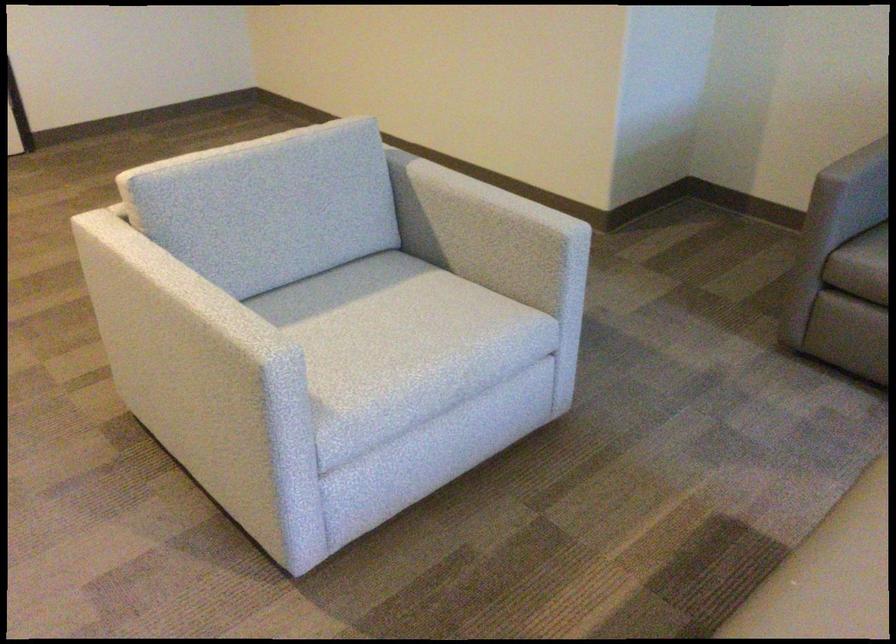
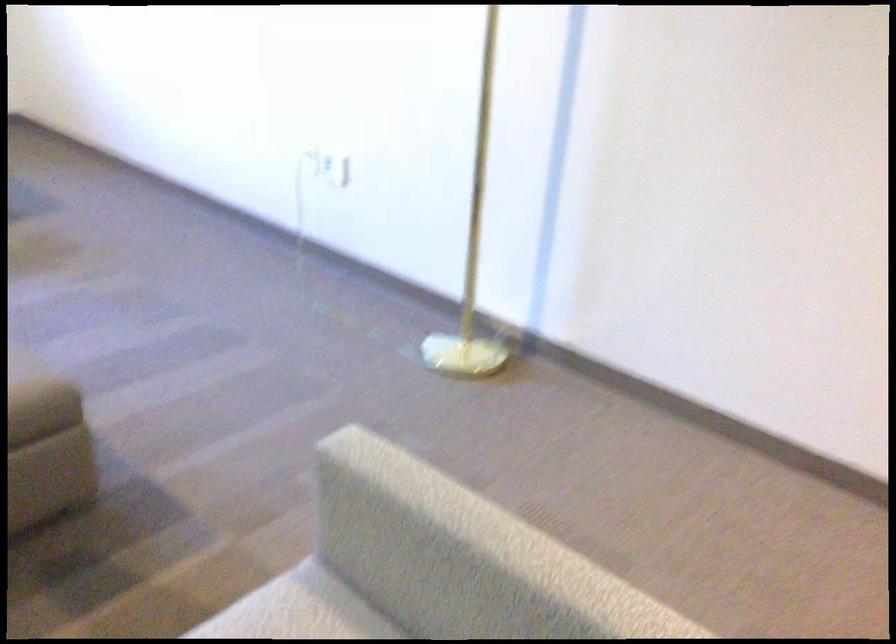
The point at (x=227, y=330) is marked in the first image. Where is the corresponding point in the second image?

(421, 489)